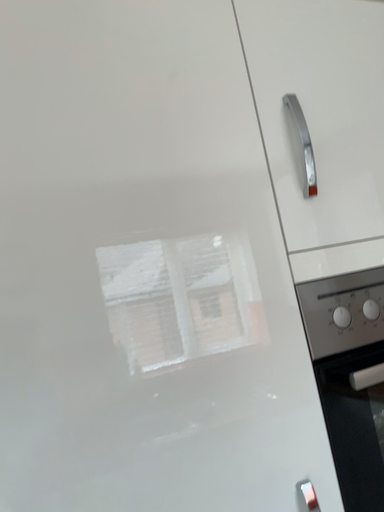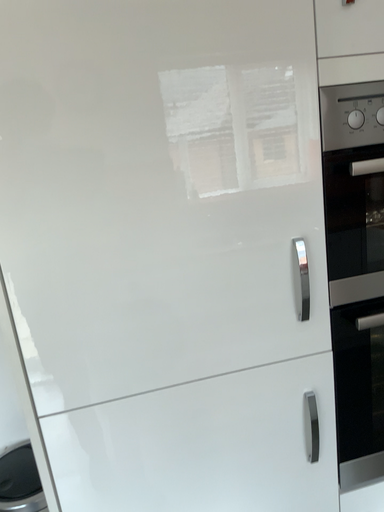
Question: How did the camera likely rotate when shooting the video?

Choices:
 (A) rotated downward
 (B) rotated upward

Answer: (A)